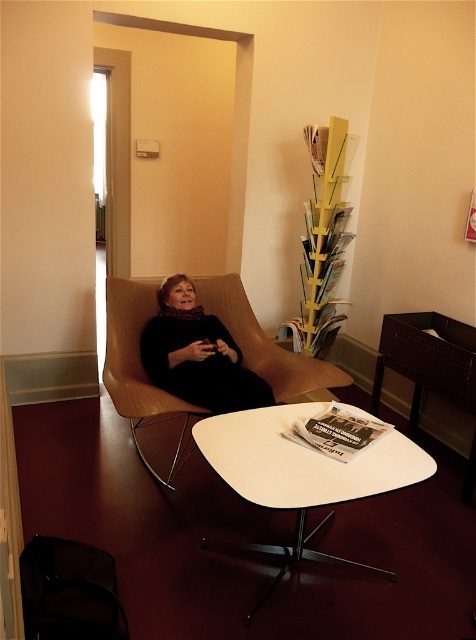
Question: Can you confirm if black soft fabric woman at center is wider than black glossy magazine at center?

Choices:
 (A) yes
 (B) no

Answer: (A)

Question: Can you confirm if black soft fabric woman at center is positioned above black glossy magazine at center?

Choices:
 (A) no
 (B) yes

Answer: (B)

Question: Can you confirm if wooden chair at center is wider than black soft fabric woman at center?

Choices:
 (A) yes
 (B) no

Answer: (B)

Question: Which object is positioned farthest from the white glossy table at center?

Choices:
 (A) black soft fabric woman at center
 (B) black glossy magazine at center

Answer: (A)

Question: Which object is farther from the camera taking this photo?

Choices:
 (A) black glossy magazine at center
 (B) white glossy table at center
 (C) black soft fabric woman at center
 (D) wooden chair at center

Answer: (C)

Question: Which point is farther from the camera taking this photo?

Choices:
 (A) (205, 420)
 (B) (249, 387)
 (C) (166, 396)

Answer: (B)